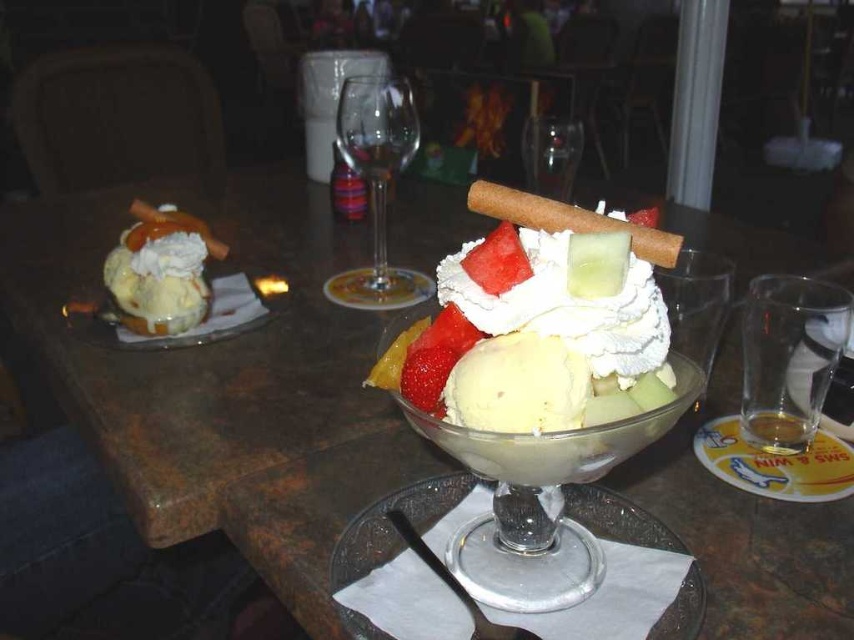
Can you confirm if transparent glass wine glass at center is thinner than red matte strawberry at center?

No, transparent glass wine glass at center is not thinner than red matte strawberry at center.

Is point (360, 128) in front of point (488, 288)?

No.

Where is `transparent glass wine glass at center`? transparent glass wine glass at center is located at coordinates (376, 184).

At what (x,y) coordinates should I click in order to perform the action: click on transparent glass wine glass at center. Please return your answer as a coordinate pair (x, y). This screenshot has width=854, height=640. Looking at the image, I should click on (376, 184).

Between matte white ice cream sundae at left and red matte strawberry at center, which one appears on the left side from the viewer's perspective?

matte white ice cream sundae at left

Which is in front, point (176, 314) or point (521, 257)?

Positioned in front is point (521, 257).

Identify the location of matte white ice cream sundae at left. (161, 269).

In the scene shown: Who is more forward, (244, 541) or (265, 308)?

Point (244, 541)

Is point (723, 509) less distant than point (71, 324)?

That is True.

The width and height of the screenshot is (854, 640). I want to click on brown marble table at center, so (225, 381).